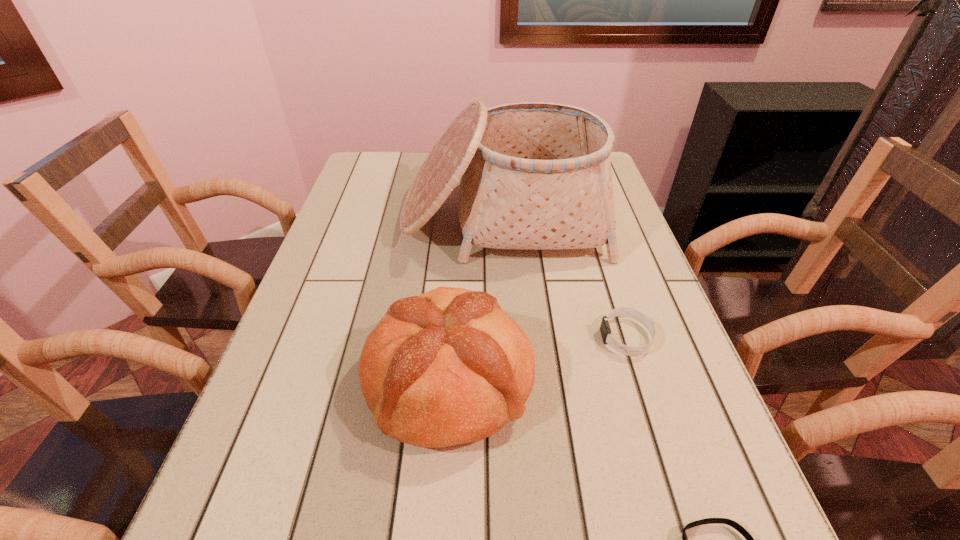
Identify the location of object located in the far edge section of the desktop. (534, 175).

You are a GUI agent. You are given a task and a screenshot of the screen. Output one action in this format:
    pyautogui.click(x=<x>, y=<y>)
    Task: Click on the basket situated at the right edge
    
    Given the screenshot: What is the action you would take?
    pyautogui.click(x=534, y=175)

I want to click on wristband present at the right edge, so click(605, 330).

This screenshot has width=960, height=540. Identify the location of object that is at the far right corner. (534, 175).

I want to click on vacant space at the left edge of the desktop, so click(334, 258).

This screenshot has height=540, width=960. In the image, there is a desktop. In order to click on free region at the right edge in this screenshot , I will do `click(585, 262)`.

The width and height of the screenshot is (960, 540). I want to click on vacant space at the far left corner, so click(x=387, y=180).

At what (x,y) coordinates should I click in order to perform the action: click on vacant space at the near left corner of the desktop. Please return your answer as a coordinate pair (x, y). The image size is (960, 540). Looking at the image, I should click on click(x=275, y=539).

Image resolution: width=960 pixels, height=540 pixels. What are the coordinates of `free space that is in between the farther wristband and the farthest object` in the screenshot? It's located at (564, 278).

Where is `free point between the farther wristband and the bread`? free point between the farther wristband and the bread is located at coordinates (538, 358).